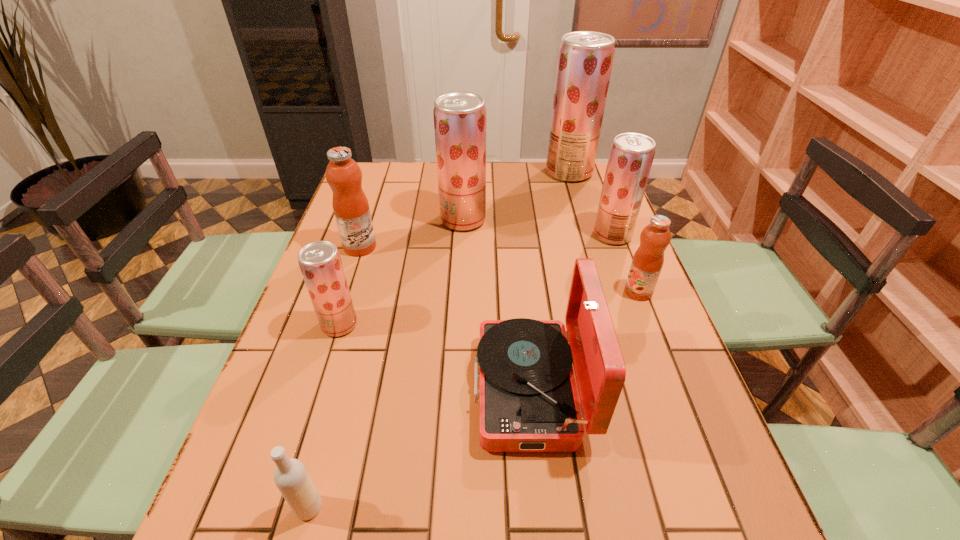
Select which object is the seventh closest to the fifth farthest object. Please provide its 2D coordinates. Your answer should be formatted as a tuple, i.e. [(x, y)], where the tuple contains the x and y coordinates of a point satisfying the conditions above.

[(291, 477)]

Locate an element on the screen. The height and width of the screenshot is (540, 960). the fourth closest fruit juice to the third strawberry fruit juice from right to left is located at coordinates (320, 262).

Identify which fruit juice is the fifth nearest to the tallest object. Please provide its 2D coordinates. Your answer should be formatted as a tuple, i.e. [(x, y)], where the tuple contains the x and y coordinates of a point satisfying the conditions above.

[(320, 262)]

Identify the location of strawberry fruit juice that can be found as the fourth closest to the phonograph_record. The height and width of the screenshot is (540, 960). (585, 59).

Identify which strawberry fruit juice is located as the second nearest to the nearest object. Please provide its 2D coordinates. Your answer should be formatted as a tuple, i.e. [(x, y)], where the tuple contains the x and y coordinates of a point satisfying the conditions above.

[(459, 117)]

Where is `free location that satisfies the following two spatial constraints: 1. on the back side of the smallest strawberry fruit juice; 2. on the left side of the biggest strawberry fruit juice`? free location that satisfies the following two spatial constraints: 1. on the back side of the smallest strawberry fruit juice; 2. on the left side of the biggest strawberry fruit juice is located at coordinates (388, 172).

Where is `vacant area in the image that satisfies the following two spatial constraints: 1. on the front label of the farther orange fruit juice; 2. on the right side of the vodka`? Image resolution: width=960 pixels, height=540 pixels. vacant area in the image that satisfies the following two spatial constraints: 1. on the front label of the farther orange fruit juice; 2. on the right side of the vodka is located at coordinates (276, 508).